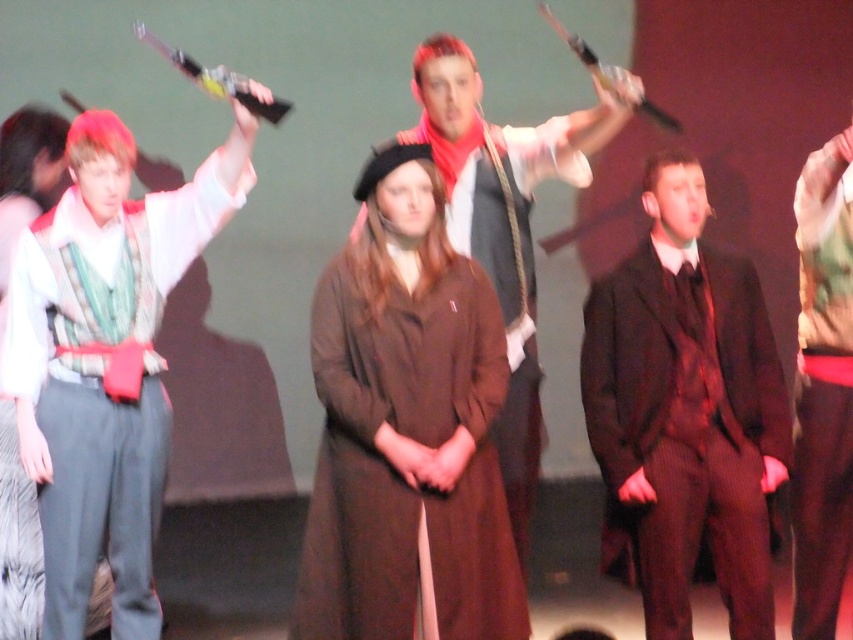
Question: Which of the following is the closest to the observer?

Choices:
 (A) dark brown suit at center
 (B) camouflage fabric jacket at right
 (C) matte gray vest at center
 (D) brown woolen coat at center

Answer: (D)

Question: Is the position of brown woolen coat at center more distant than that of matte green vest at left?

Choices:
 (A) no
 (B) yes

Answer: (A)

Question: In this image, where is matte green vest at left located relative to dark brown suit at center?

Choices:
 (A) above
 (B) below

Answer: (A)

Question: Does brown woolen coat at center have a lesser width compared to matte green vest at left?

Choices:
 (A) no
 (B) yes

Answer: (B)

Question: Estimate the real-world distances between objects in this image. Which object is farther from the matte green vest at left?

Choices:
 (A) dark brown suit at center
 (B) brown woolen coat at center
 (C) camouflage fabric jacket at right

Answer: (C)

Question: Which point is closer to the camera?

Choices:
 (A) matte green vest at left
 (B) matte gray vest at center

Answer: (A)